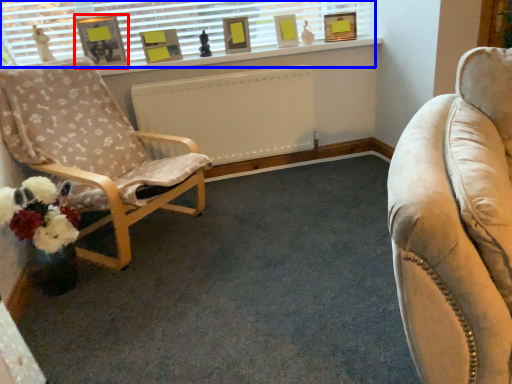
Question: Among these objects, which one is farthest to the camera, picture frame (highlighted by a red box) or window (highlighted by a blue box)?

Choices:
 (A) picture frame
 (B) window

Answer: (B)